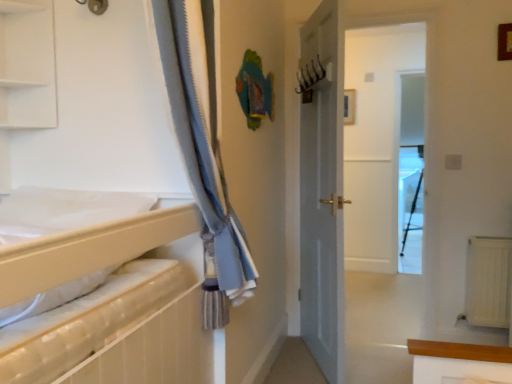
Question: In terms of height, does white matte sheet at left look taller or shorter compared to transparent glass screen door at center?

Choices:
 (A) tall
 (B) short

Answer: (B)

Question: From a real-world perspective, is white matte sheet at left above or below transparent glass screen door at center?

Choices:
 (A) above
 (B) below

Answer: (A)

Question: Which object is the closest to the white textured radiator at lower right?

Choices:
 (A) wooden picture frame at upper right
 (B) transparent glass screen door at center
 (C) white matte sheet at left
 (D) white matte shelf at upper left

Answer: (A)

Question: Which of these objects is positioned closest to the white matte shelf at upper left?

Choices:
 (A) transparent glass screen door at center
 (B) white textured radiator at lower right
 (C) wooden picture frame at upper right
 (D) white matte sheet at left

Answer: (D)